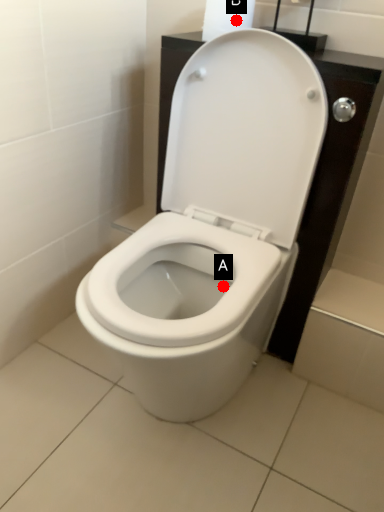
Question: Two points are circled on the image, labeled by A and B beside each circle. Which point appears farthest from the camera in this image?

Choices:
 (A) A is further
 (B) B is further

Answer: (A)